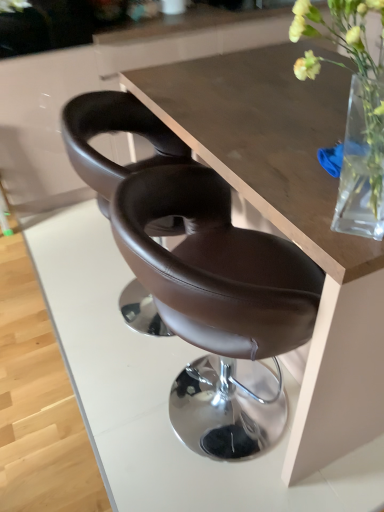
Question: Based on their sizes in the image, would you say white matte flower at upper center is bigger or smaller than brown leather chair at center, the second chair viewed from the front?

Choices:
 (A) big
 (B) small

Answer: (B)

Question: From the image's perspective, is white matte flower at upper center above or below brown leather chair at center, the second chair viewed from the front?

Choices:
 (A) above
 (B) below

Answer: (A)

Question: Estimate the real-world distances between objects in this image. Which object is closer to the wooden table at center?

Choices:
 (A) brown leather chair at center, the 2th chair when ordered from back to front
 (B) brown leather chair at center, positioned as the 1th chair in back-to-front order
 (C) translucent glass vase at upper right
 (D) white matte flower at upper center

Answer: (B)

Question: Estimate the real-world distances between objects in this image. Which object is farther from the wooden table at center?

Choices:
 (A) brown leather chair at center, positioned as the 1th chair in back-to-front order
 (B) brown leather chair at center, the 2th chair when ordered from back to front
 (C) translucent glass vase at upper right
 (D) white matte flower at upper center

Answer: (D)